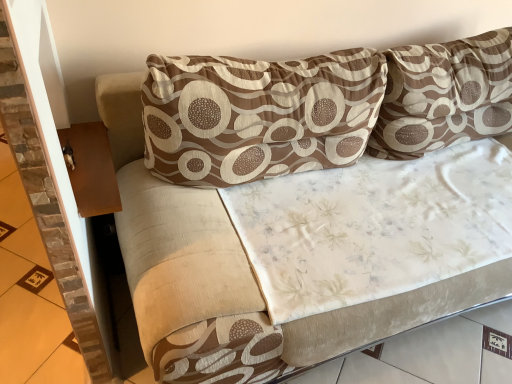
The width and height of the screenshot is (512, 384). What do you see at coordinates (30, 296) in the screenshot?
I see `brown stone tile at left` at bounding box center [30, 296].

How much space does brown textured pillow at center, positioned as the first pillow in left-to-right order, occupy vertically?

It is 18.63 inches.

Describe the element at coordinates (258, 115) in the screenshot. This screenshot has width=512, height=384. I see `brown textured pillow at center, positioned as the first pillow in left-to-right order` at that location.

Locate an element on the screen. This screenshot has width=512, height=384. brown stone tile at left is located at coordinates (30, 296).

Would you say brown textured pillow at upper right, acting as the second pillow starting from the left, is to the left or to the right of brown wood table at left in the picture?

brown textured pillow at upper right, acting as the second pillow starting from the left, is positioned on brown wood table at left's right side.

From a real-world perspective, is brown textured pillow at upper right, acting as the second pillow starting from the left, physically located above or below brown wood table at left?

Clearly, from a real-world perspective, brown textured pillow at upper right, acting as the second pillow starting from the left, is above brown wood table at left.

Can you confirm if brown textured pillow at upper right, acting as the second pillow starting from the left, is bigger than brown wood table at left?

Indeed, brown textured pillow at upper right, acting as the second pillow starting from the left, has a larger size compared to brown wood table at left.

Is brown textured pillow at upper right, the first pillow when ordered from right to left, facing away from brown wood table at left?

No, brown textured pillow at upper right, the first pillow when ordered from right to left,'s orientation is not away from brown wood table at left.

From the image's perspective, who appears lower, brown stone tile at left or brown textured pillow at upper right, the first pillow when ordered from right to left?

brown stone tile at left, from the image's perspective.

From the picture: Is brown stone tile at left closer to the viewer compared to brown textured pillow at upper right, the first pillow when ordered from right to left?

Yes.

Does brown stone tile at left touch brown textured pillow at upper right, acting as the second pillow starting from the left?

No, brown stone tile at left is not making contact with brown textured pillow at upper right, acting as the second pillow starting from the left.

Does brown textured pillow at upper right, acting as the second pillow starting from the left, contain brown stone tile at left?

No, brown stone tile at left is located outside of brown textured pillow at upper right, acting as the second pillow starting from the left.

From a real-world perspective, is brown textured pillow at upper right, the first pillow when ordered from right to left, under brown stone tile at left?

→ Actually, brown textured pillow at upper right, the first pillow when ordered from right to left, is physically above brown stone tile at left in the real world.

From the image's perspective, which is below, brown textured pillow at upper right, acting as the second pillow starting from the left, or brown stone tile at left?

brown stone tile at left.

Could you tell me if brown textured pillow at upper right, acting as the second pillow starting from the left, is turned towards brown stone tile at left?

No.

Is brown stone tile at left situated inside brown textured pillow at center, positioned as the first pillow in left-to-right order, or outside?

brown stone tile at left is located beyond the bounds of brown textured pillow at center, positioned as the first pillow in left-to-right order.

From a real-world perspective, is brown stone tile at left below brown textured pillow at center, marked as the 2th pillow in a right-to-left arrangement?

Yes, from a real-world perspective, brown stone tile at left is below brown textured pillow at center, marked as the 2th pillow in a right-to-left arrangement.

Is brown stone tile at left behind brown textured pillow at center, positioned as the first pillow in left-to-right order?

Yes, brown stone tile at left is behind brown textured pillow at center, positioned as the first pillow in left-to-right order.

Considering the relative sizes of brown textured pillow at center, positioned as the first pillow in left-to-right order, and brown wood table at left in the image provided, is brown textured pillow at center, positioned as the first pillow in left-to-right order, taller than brown wood table at left?

Yes.

From a real-world perspective, is brown textured pillow at center, marked as the 2th pillow in a right-to-left arrangement, positioned over brown wood table at left based on gravity?

Yes, from a real-world perspective, brown textured pillow at center, marked as the 2th pillow in a right-to-left arrangement, is above brown wood table at left.

Is brown textured pillow at center, marked as the 2th pillow in a right-to-left arrangement, looking in the opposite direction of brown wood table at left?

brown textured pillow at center, marked as the 2th pillow in a right-to-left arrangement, is not turned away from brown wood table at left.

This screenshot has width=512, height=384. I want to click on pillow in front of the brown wood table at left, so click(258, 115).

Is point (166, 106) positioned behind point (395, 145)?

No, it is in front of (395, 145).

From the picture: Can you confirm if brown textured pillow at center, positioned as the first pillow in left-to-right order, is bigger than brown textured pillow at upper right, the first pillow when ordered from right to left?

Actually, brown textured pillow at center, positioned as the first pillow in left-to-right order, might be smaller than brown textured pillow at upper right, the first pillow when ordered from right to left.

Find the location of a particular element. pillow that is in front of the brown textured pillow at upper right, the first pillow when ordered from right to left is located at coordinates [x=258, y=115].

Is brown textured pillow at upper right, acting as the second pillow starting from the left, located within brown textured pillow at center, positioned as the first pillow in left-to-right order?

That's incorrect, brown textured pillow at upper right, acting as the second pillow starting from the left, is not inside brown textured pillow at center, positioned as the first pillow in left-to-right order.

Is point (22, 375) positioned after point (88, 181)?

Yes.

Looking at this image, is brown stone tile at left oriented away from brown wood table at left?

No, brown wood table at left is not at the back of brown stone tile at left.

Can you tell me how much brown stone tile at left and brown wood table at left differ in facing direction?

The angular difference between brown stone tile at left and brown wood table at left is 179 degrees.

Considering the sizes of brown stone tile at left and brown wood table at left in the image, is brown stone tile at left taller or shorter than brown wood table at left?

Considering their sizes, brown stone tile at left has more height than brown wood table at left.

You are a GUI agent. You are given a task and a screenshot of the screen. Output one action in this format:
    pyautogui.click(x=<x>, y=<y>)
    Task: Click on the table that appears below the brown textured pillow at upper right, acting as the second pillow starting from the left (from the image's perspective)
    This screenshot has height=384, width=512.
    Given the screenshot: What is the action you would take?
    pyautogui.click(x=91, y=168)

Find the location of a particular element. The width and height of the screenshot is (512, 384). the 2nd pillow above the brown stone tile at left (from the image's perspective) is located at coordinates (444, 95).

When comparing their distances from brown stone tile at left, does brown textured pillow at center, positioned as the first pillow in left-to-right order, or brown wood table at left seem closer?

Based on the image, brown wood table at left appears to be nearer to brown stone tile at left.

Which object lies nearer to the anchor point brown textured pillow at center, positioned as the first pillow in left-to-right order, brown stone tile at left or brown wood table at left?

The object closer to brown textured pillow at center, positioned as the first pillow in left-to-right order, is brown wood table at left.

Estimate the real-world distances between objects in this image. Which object is closer to brown stone tile at left, brown wood table at left or brown textured pillow at center, positioned as the first pillow in left-to-right order?

brown wood table at left.

Consider the image. Estimate the real-world distances between objects in this image. Which object is closer to brown textured pillow at center, positioned as the first pillow in left-to-right order, brown wood table at left or brown stone tile at left?

Based on the image, brown wood table at left appears to be nearer to brown textured pillow at center, positioned as the first pillow in left-to-right order.

Looking at the image, which one is located further to brown stone tile at left, brown textured pillow at center, positioned as the first pillow in left-to-right order, or brown textured pillow at upper right, the first pillow when ordered from right to left?

brown textured pillow at upper right, the first pillow when ordered from right to left, is further to brown stone tile at left.

Considering their positions, is brown textured pillow at center, positioned as the first pillow in left-to-right order, positioned closer to brown wood table at left than brown textured pillow at upper right, acting as the second pillow starting from the left?

brown textured pillow at center, positioned as the first pillow in left-to-right order, lies closer to brown wood table at left than the other object.

When comparing their distances from brown textured pillow at upper right, the first pillow when ordered from right to left, does brown wood table at left or brown textured pillow at center, positioned as the first pillow in left-to-right order, seem further?

brown wood table at left.

Looking at the image, which one is located further to brown stone tile at left, brown textured pillow at upper right, acting as the second pillow starting from the left, or brown wood table at left?

Among the two, brown textured pillow at upper right, acting as the second pillow starting from the left, is located further to brown stone tile at left.

Identify the location of pillow between brown wood table at left and brown textured pillow at upper right, the first pillow when ordered from right to left, in the horizontal direction. This screenshot has width=512, height=384. (258, 115).

Where is `table situated between brown stone tile at left and brown textured pillow at center, marked as the 2th pillow in a right-to-left arrangement, from left to right`? The image size is (512, 384). table situated between brown stone tile at left and brown textured pillow at center, marked as the 2th pillow in a right-to-left arrangement, from left to right is located at coordinates (91, 168).

You are a GUI agent. You are given a task and a screenshot of the screen. Output one action in this format:
    pyautogui.click(x=<x>, y=<y>)
    Task: Click on the pillow situated between brown stone tile at left and brown textured pillow at upper right, acting as the second pillow starting from the left, from left to right
    Image resolution: width=512 pixels, height=384 pixels.
    Given the screenshot: What is the action you would take?
    pyautogui.click(x=258, y=115)

Where is `table between brown stone tile at left and brown textured pillow at upper right, acting as the second pillow starting from the left`? This screenshot has width=512, height=384. table between brown stone tile at left and brown textured pillow at upper right, acting as the second pillow starting from the left is located at coordinates (91, 168).